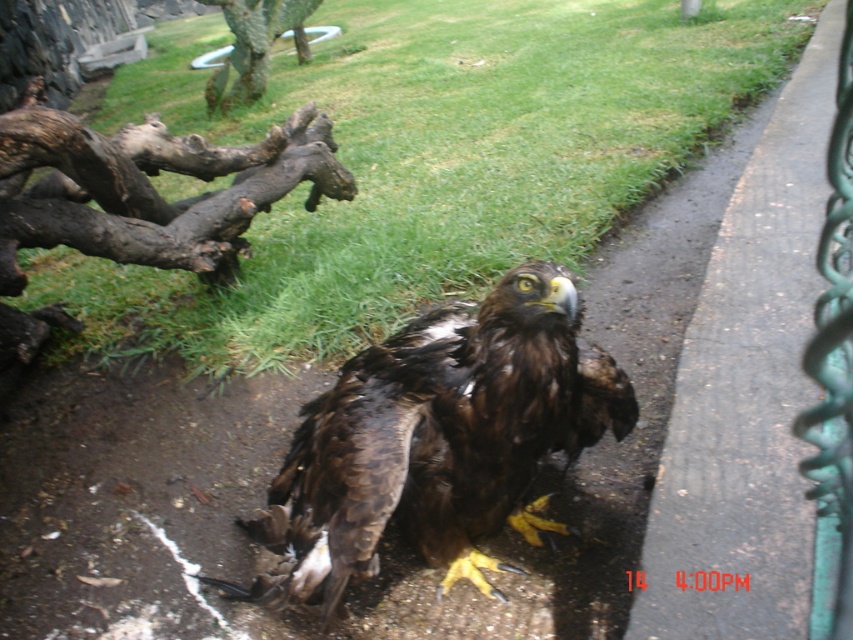
Question: Where is brown feathered eagle at center located in relation to brown rough log at upper left in the image?

Choices:
 (A) below
 (B) above

Answer: (A)

Question: Which object is the farthest from the green grass at upper center?

Choices:
 (A) green textured fence at right
 (B) brown feathered eagle at center

Answer: (A)

Question: Which of the following is the farthest from the observer?

Choices:
 (A) (338, 186)
 (B) (845, 300)
 (C) (431, 204)

Answer: (C)

Question: Can you confirm if brown rough log at upper left is wider than green textured fence at right?

Choices:
 (A) no
 (B) yes

Answer: (B)

Question: Estimate the real-world distances between objects in this image. Which object is farther from the brown feathered eagle at center?

Choices:
 (A) brown rough log at upper left
 (B) green grass at upper center

Answer: (B)

Question: Is the position of green grass at upper center more distant than that of green textured fence at right?

Choices:
 (A) no
 (B) yes

Answer: (B)